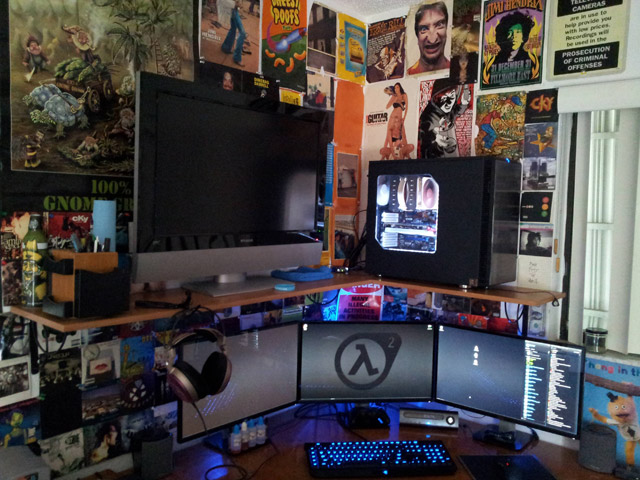
This screenshot has height=480, width=640. Find the location of `cup`. cup is located at coordinates (592, 340).